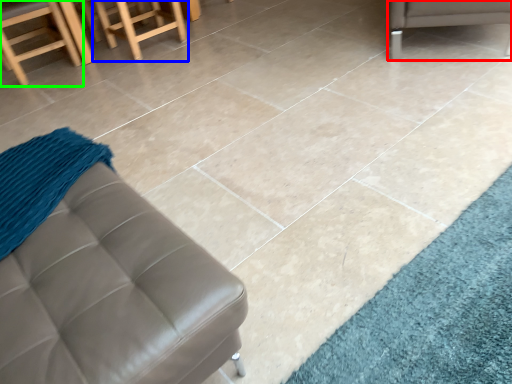
Question: Which object is positioned farthest from furniture (highlighted by a red box)? Select from stool (highlighted by a blue box) and chair (highlighted by a green box).

Choices:
 (A) stool
 (B) chair

Answer: (B)